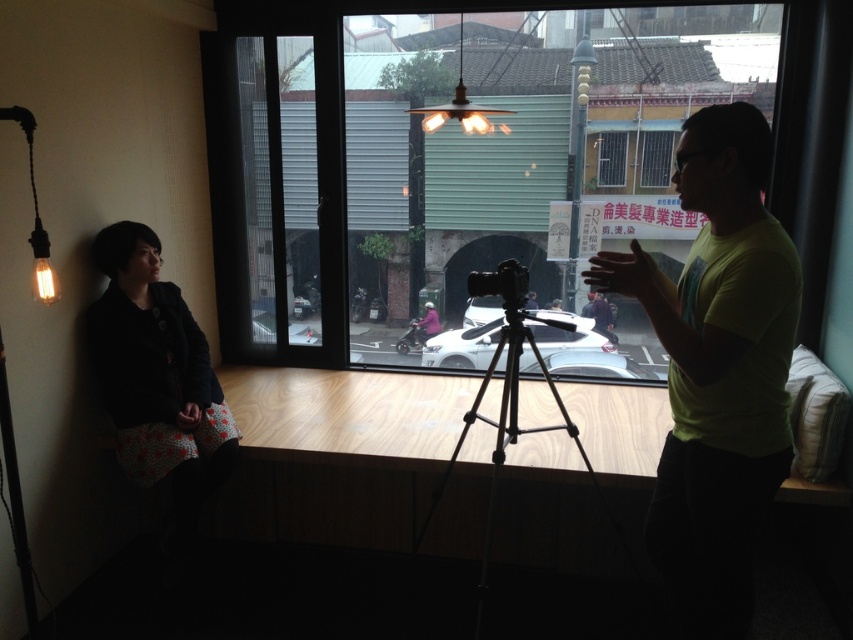
Question: Is transparent glass window at center positioned before black metal tripod at center?

Choices:
 (A) no
 (B) yes

Answer: (A)

Question: Estimate the real-world distances between objects in this image. Which object is farther from the matte brass pendant light at upper center?

Choices:
 (A) black plastic camera at center
 (B) yellow matte shirt at center

Answer: (B)

Question: Which point is farther to the camera?

Choices:
 (A) black metal tripod at center
 (B) transparent glass window at center
 (C) matte brass pendant light at upper center

Answer: (B)

Question: Does black fabric jacket at left appear on the right side of clear glass window at center?

Choices:
 (A) no
 (B) yes

Answer: (A)

Question: Where is yellow matte shirt at center located in relation to black plastic camera at center in the image?

Choices:
 (A) below
 (B) above

Answer: (A)

Question: Which point is farther to the camera?

Choices:
 (A) black metal tripod at center
 (B) black plastic camera at center

Answer: (B)